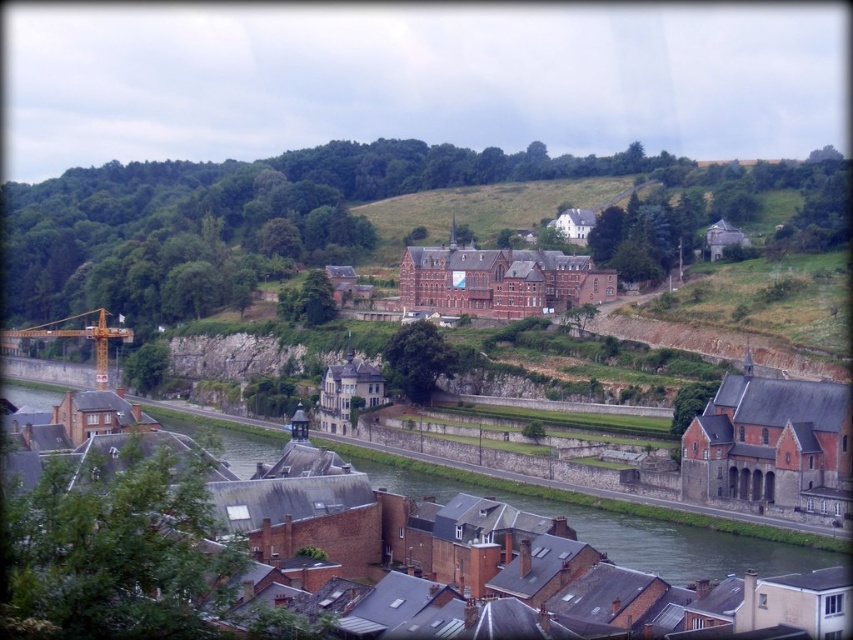
Which is above, gray concrete river at lower center or yellow metallic crane at left?

Positioned higher is yellow metallic crane at left.

Can you confirm if gray concrete river at lower center is positioned to the right of yellow metallic crane at left?

Correct, you'll find gray concrete river at lower center to the right of yellow metallic crane at left.

Between point (728, 557) and point (106, 368), which one is positioned in front?

Point (728, 557)

The image size is (853, 640). Identify the location of gray concrete river at lower center. (631, 532).